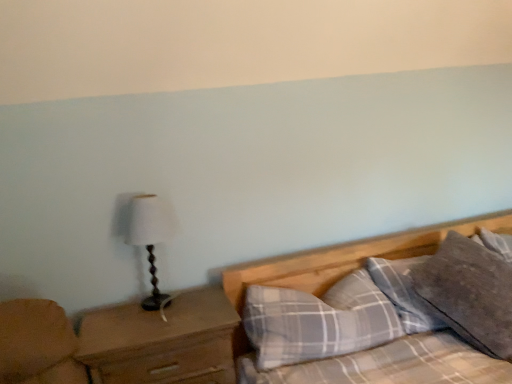
Question: Relative to wooden table lamp at left, is plaid fabric pillow at lower right, the 1th pillow viewed from the left, in front or behind?

Choices:
 (A) front
 (B) behind

Answer: (A)

Question: Looking at the image, does plaid fabric pillow at lower right, arranged as the 2th pillow when viewed from the right, seem bigger or smaller compared to wooden table lamp at left?

Choices:
 (A) big
 (B) small

Answer: (A)

Question: Based on their relative distances, which object is nearer to the brown wooden nightstand at left?

Choices:
 (A) wooden table lamp at left
 (B) plaid fabric pillow at lower right, the 1th pillow viewed from the left
 (C) gray cotton pillow at upper right, which is counted as the first pillow, starting from the right

Answer: (A)

Question: Which is nearer to the gray cotton pillow at upper right, which is counted as the first pillow, starting from the right?

Choices:
 (A) brown wooden nightstand at left
 (B) wooden table lamp at left
 (C) plaid fabric pillow at lower right, arranged as the 2th pillow when viewed from the right

Answer: (C)